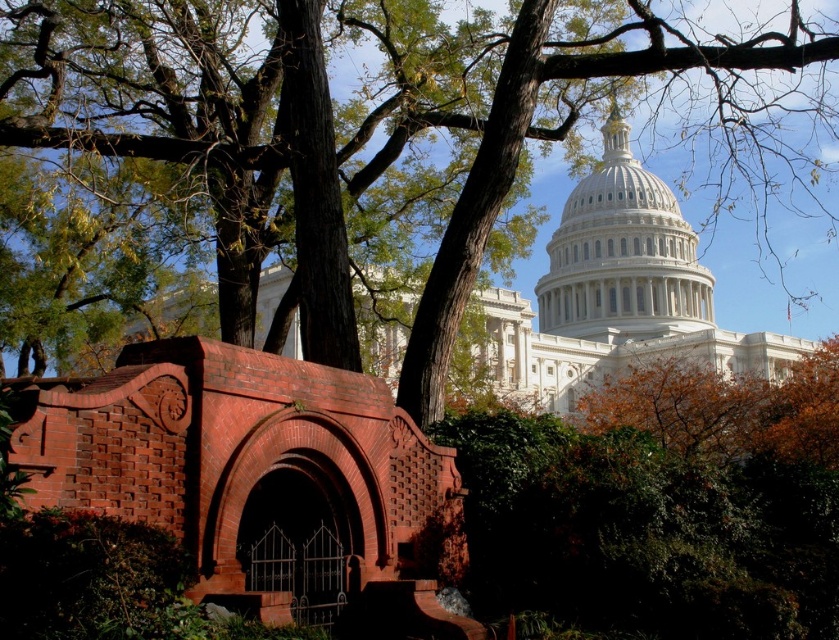
Is green leafy tree at upper center closer to camera compared to white marble dome at center?

Yes, it is in front of white marble dome at center.

Does point (366, 140) come farther from viewer compared to point (628, 177)?

No, (366, 140) is in front of (628, 177).

Locate an element on the screen. The width and height of the screenshot is (839, 640). green leafy tree at upper center is located at coordinates tap(353, 144).